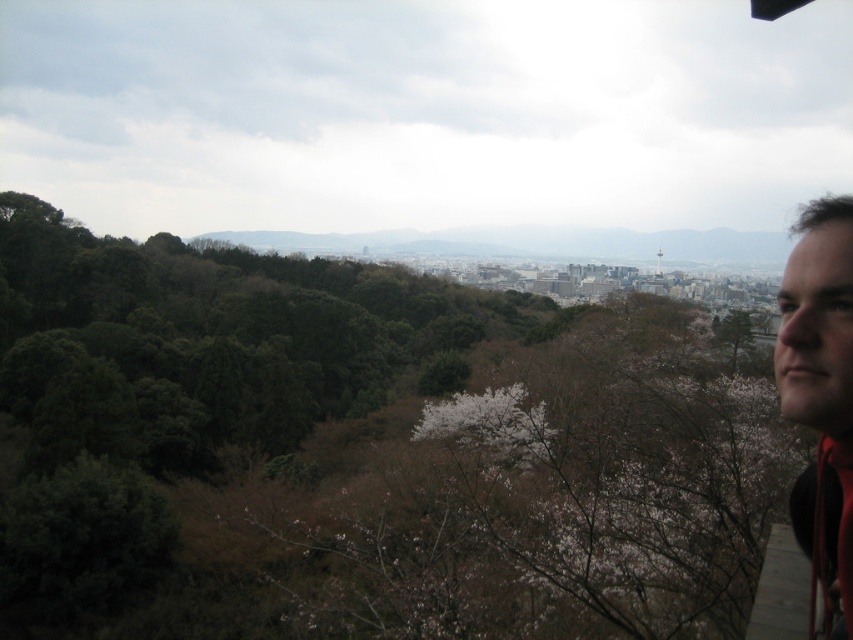
Which is more to the left, green matte tree at upper right or matte black hair at upper right?

green matte tree at upper right is more to the left.

Describe the element at coordinates (364, 451) in the screenshot. I see `green matte tree at upper right` at that location.

What do you see at coordinates (364, 451) in the screenshot? This screenshot has height=640, width=853. I see `green matte tree at upper right` at bounding box center [364, 451].

Identify the location of green matte tree at upper right. (364, 451).